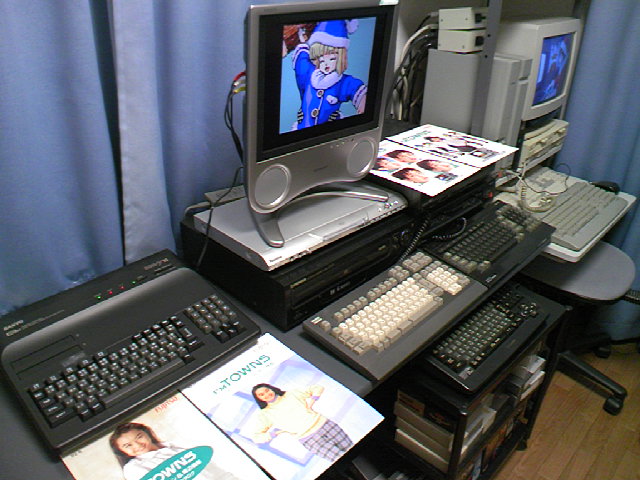
Locate an element on the screen. rolling table is located at coordinates (555, 316).